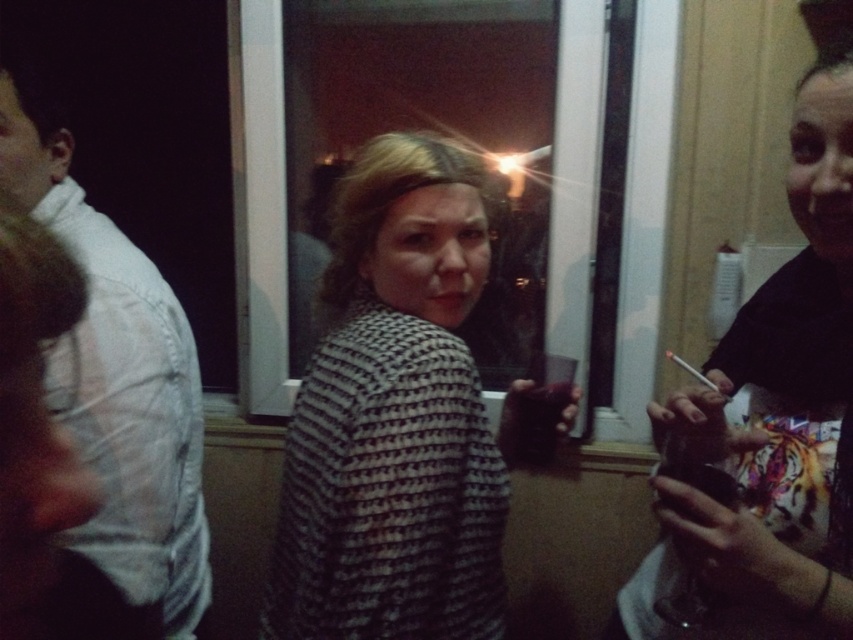
Is point (70, 230) closer to viewer compared to point (712, 388)?

No.

Is point (171, 333) positioned in front of point (685, 364)?

That is True.

Where is `white cotton shirt at left`? The width and height of the screenshot is (853, 640). white cotton shirt at left is located at coordinates (117, 376).

Is black matte shirt at right above white cotton shirt at left?

No, black matte shirt at right is not above white cotton shirt at left.

Who is positioned more to the right, black matte shirt at right or white cotton shirt at left?

From the viewer's perspective, black matte shirt at right appears more on the right side.

The width and height of the screenshot is (853, 640). What do you see at coordinates (770, 422) in the screenshot? I see `black matte shirt at right` at bounding box center [770, 422].

The image size is (853, 640). I want to click on black matte shirt at right, so click(770, 422).

Can you confirm if patterned fabric sweater at center is positioned to the left of white cotton shirt at left?

No, patterned fabric sweater at center is not to the left of white cotton shirt at left.

Who is taller, patterned fabric sweater at center or white cotton shirt at left?

Standing taller between the two is white cotton shirt at left.

Which is in front, point (328, 294) or point (114, 557)?

Point (114, 557) is more forward.

This screenshot has height=640, width=853. In order to click on patterned fabric sweater at center in this screenshot , I will do `click(396, 417)`.